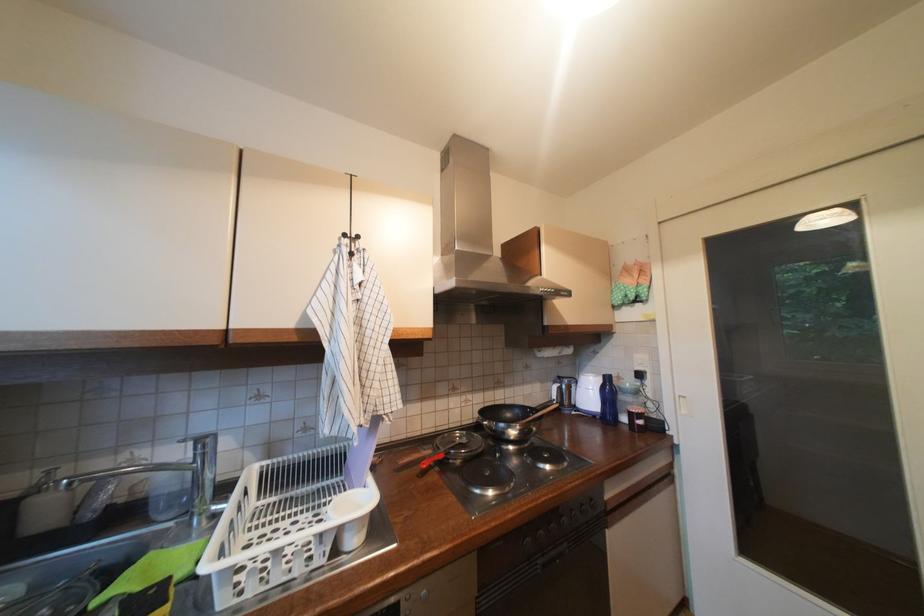
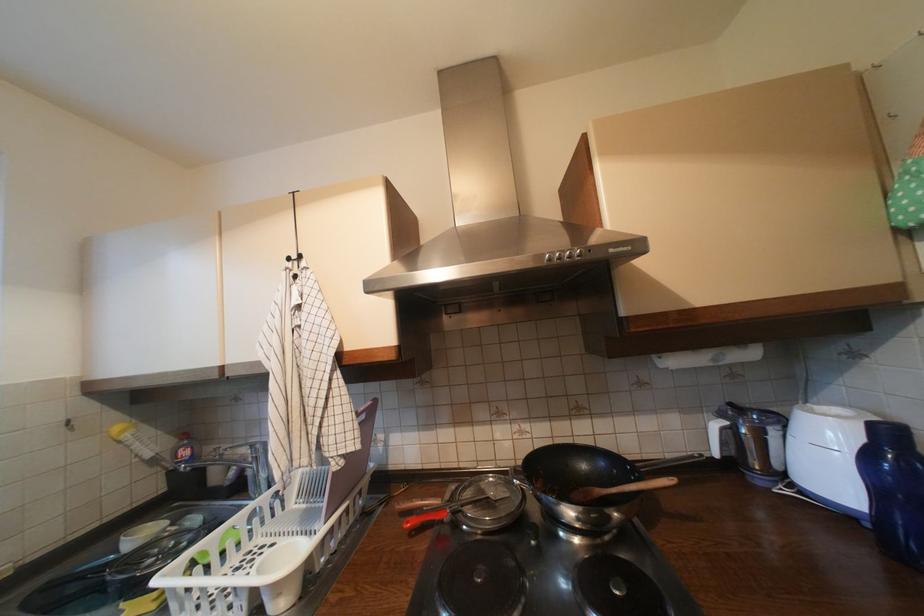
In the second image, find the point that corresponds to pixel 566 386 in the first image.

(735, 424)